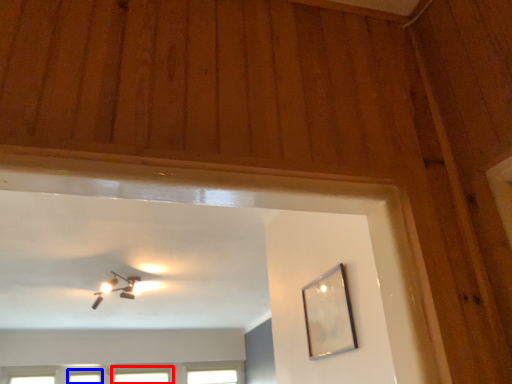
Question: Which object appears farthest to the camera in this image, window (highlighted by a red box) or window (highlighted by a blue box)?

Choices:
 (A) window
 (B) window

Answer: (A)